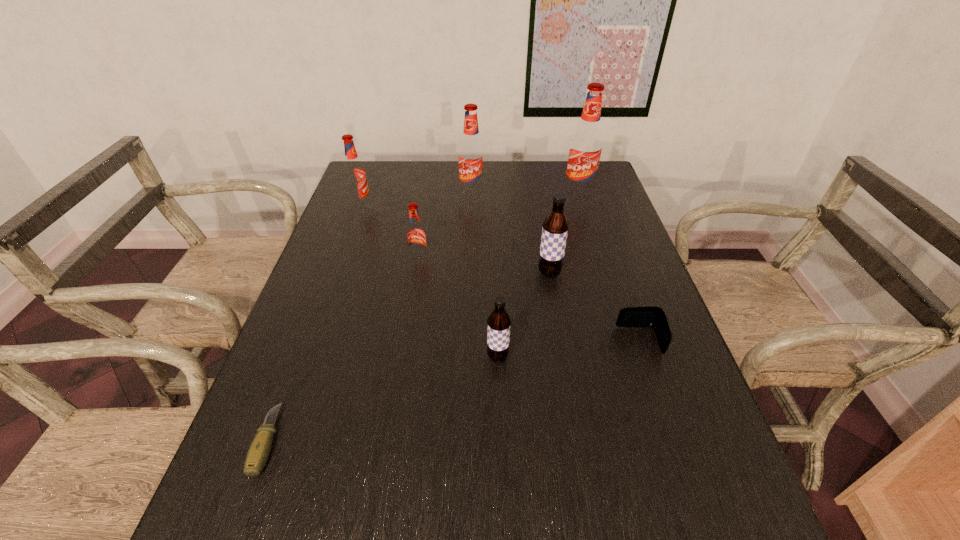
Locate an element on the screen. the biggest red root beer is located at coordinates (586, 144).

Find the location of a particular element. This screenshot has width=960, height=540. the tallest root beer is located at coordinates (586, 144).

Where is `the third red root beer from left to right`? The image size is (960, 540). the third red root beer from left to right is located at coordinates (471, 151).

Where is `the fourth object from left to right`? The width and height of the screenshot is (960, 540). the fourth object from left to right is located at coordinates (471, 151).

The height and width of the screenshot is (540, 960). I want to click on the bigger brown root beer, so click(x=555, y=226).

Where is `the third object from right to left`? the third object from right to left is located at coordinates (555, 226).

At what (x,y) coordinates should I click in order to perform the action: click on the leftmost root beer. Please return your answer as a coordinate pair (x, y). Looking at the image, I should click on (355, 177).

You are a GUI agent. You are given a task and a screenshot of the screen. Output one action in this format:
    pyautogui.click(x=<x>, y=<y>)
    Task: Click on the third biggest red root beer
    
    Given the screenshot: What is the action you would take?
    pyautogui.click(x=355, y=177)

The width and height of the screenshot is (960, 540). I want to click on the fifth root beer from right to left, so click(416, 236).

The image size is (960, 540). What are the coordinates of `the smallest red root beer` in the screenshot? It's located at (416, 236).